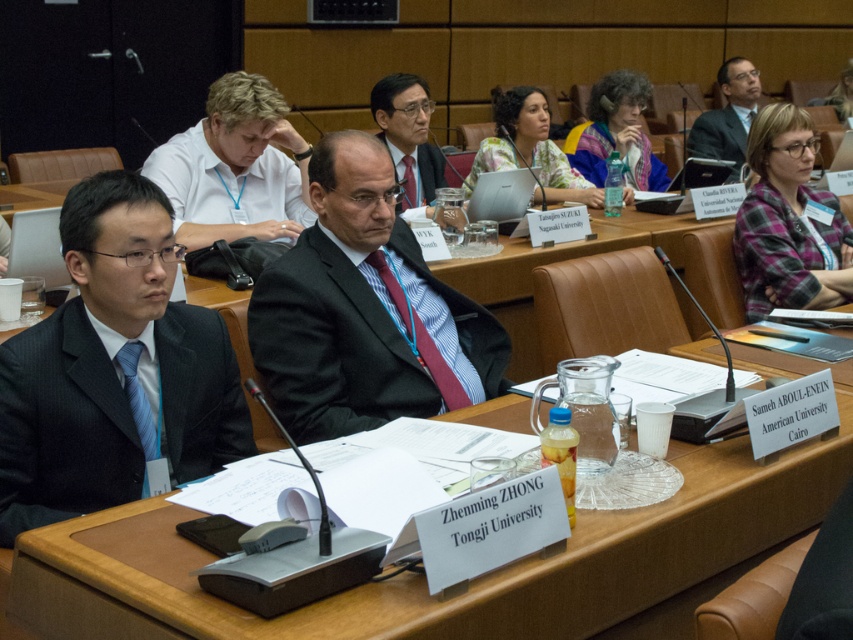
You are an attendee at this conference and want to know which of the two points, point (264, 186) or point (415, 189), is closer to you. Based on the scene description, can you determine this?

Point (264, 186) is closer to the viewer than point (415, 189).

You are organizing a photo shoot and need to ensure proper framing. Given the scene described, which object between the matte pink blouse at center and the matte black suit at center should be prioritized for focus due to its size?

The matte pink blouse at center should be prioritized for focus because it is larger in size than the matte black suit at center.

You are an event organizer arranging name tags for the panelists. You have a name tag for the person wearing the blue silk tie at left and another for the black satin suit at center. Based on their positions, where should you place each name tag on the table?

The blue silk tie at left is on the left side, so its name tag should be placed to the left. The black satin suit at center is to the right of the blue silk tie at left, so its name tag should be positioned to the right.